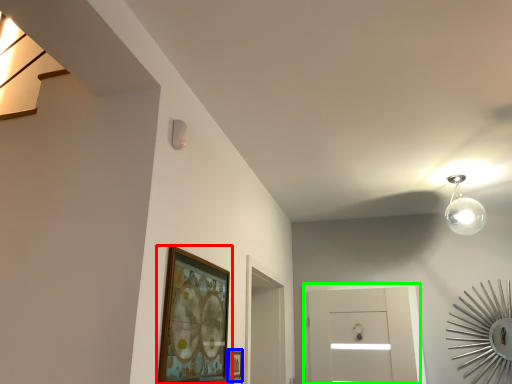
Question: Which object is the closest to the picture frame (highlighted by a red box)? Choose among these: picture frame (highlighted by a blue box) or glass door (highlighted by a green box).

Choices:
 (A) picture frame
 (B) glass door

Answer: (A)